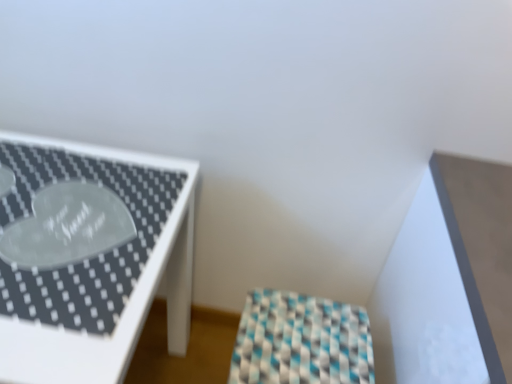
Where is `empty space that is ontop of white glossy table at left, positioned as the 1th furniture in left-to-right order (from a real-world perspective)`? This screenshot has height=384, width=512. empty space that is ontop of white glossy table at left, positioned as the 1th furniture in left-to-right order (from a real-world perspective) is located at coordinates (75, 214).